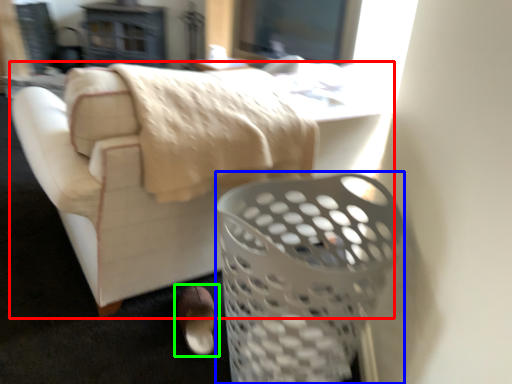
Question: Considering the real-world distances, which object is closest to furniture (highlighted by a red box)? basket (highlighted by a blue box) or footwear (highlighted by a green box).

Choices:
 (A) basket
 (B) footwear

Answer: (B)